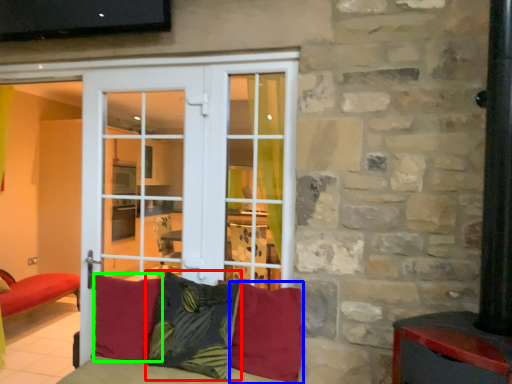
Question: Considering the real-world distances, which object is closest to pillow (highlighted by a red box)? pillow (highlighted by a blue box) or pillow (highlighted by a green box).

Choices:
 (A) pillow
 (B) pillow

Answer: (A)